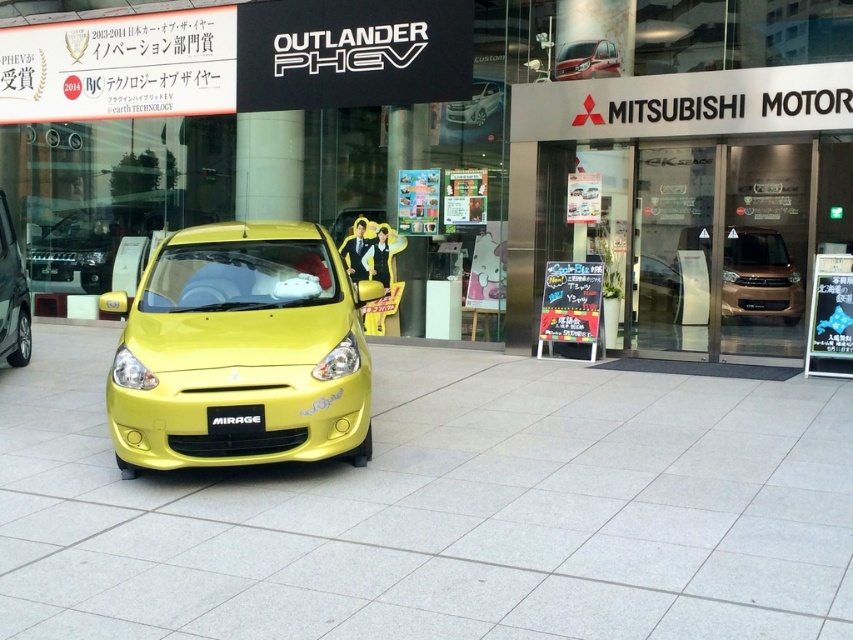
Between gold metallic suv at center and matte red car at upper right, which one appears on the right side from the viewer's perspective?

Positioned to the right is gold metallic suv at center.

Is point (769, 282) behind point (582, 49)?

Yes, it is behind point (582, 49).

Does point (711, 262) come behind point (579, 77)?

That is True.

At what (x,y) coordinates should I click in order to perform the action: click on gold metallic suv at center. Please return your answer as a coordinate pair (x, y). Looking at the image, I should click on (759, 276).

Does point (560, 74) come closer to viewer compared to point (480, 93)?

Yes, point (560, 74) is in front of point (480, 93).

Is point (563, 58) farther from viewer compared to point (480, 81)?

No, it is not.

Between point (569, 54) and point (495, 99), which one is positioned in front?

Point (569, 54) is more forward.

Where is `matte red car at upper right`? The height and width of the screenshot is (640, 853). matte red car at upper right is located at coordinates (x=585, y=60).

Describe the element at coordinates (241, 349) in the screenshot. I see `metallic yellow car at center` at that location.

Who is more distant from viewer, [224,304] or [593,49]?

Point [593,49]

Locate an element on the screen. The height and width of the screenshot is (640, 853). metallic yellow car at center is located at coordinates (241, 349).